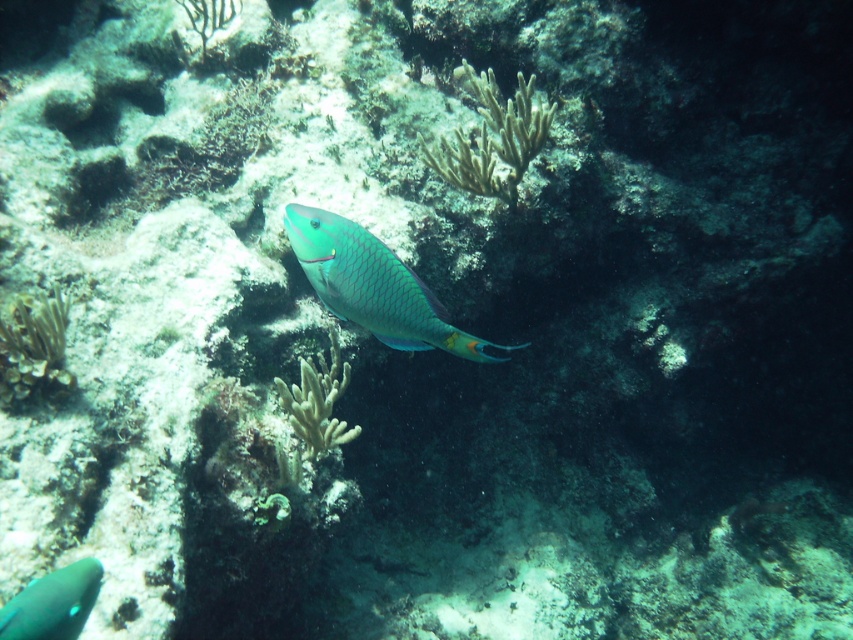
Question: Which of the following is the farthest from the observer?

Choices:
 (A) (47, 378)
 (B) (379, 289)
 (C) (518, 84)

Answer: (C)

Question: Does teal glossy fish at center have a greater width compared to yellowish-green textured coral at center?

Choices:
 (A) no
 (B) yes

Answer: (B)

Question: Estimate the real-world distances between objects in this image. Which object is farther from the teal glossy fish at center?

Choices:
 (A) green soft coral at lower left
 (B) teal glossy fish at lower left

Answer: (A)

Question: Does yellowish-green textured coral at center have a larger size compared to green soft coral at lower left?

Choices:
 (A) yes
 (B) no

Answer: (A)

Question: Which object is positioned closest to the yellowish-green textured coral at center?

Choices:
 (A) white coral at center
 (B) teal glossy fish at center
 (C) teal glossy fish at lower left
 (D) green soft coral at lower left

Answer: (A)

Question: In this image, where is teal glossy fish at center located relative to green soft coral at lower left?

Choices:
 (A) below
 (B) above

Answer: (B)